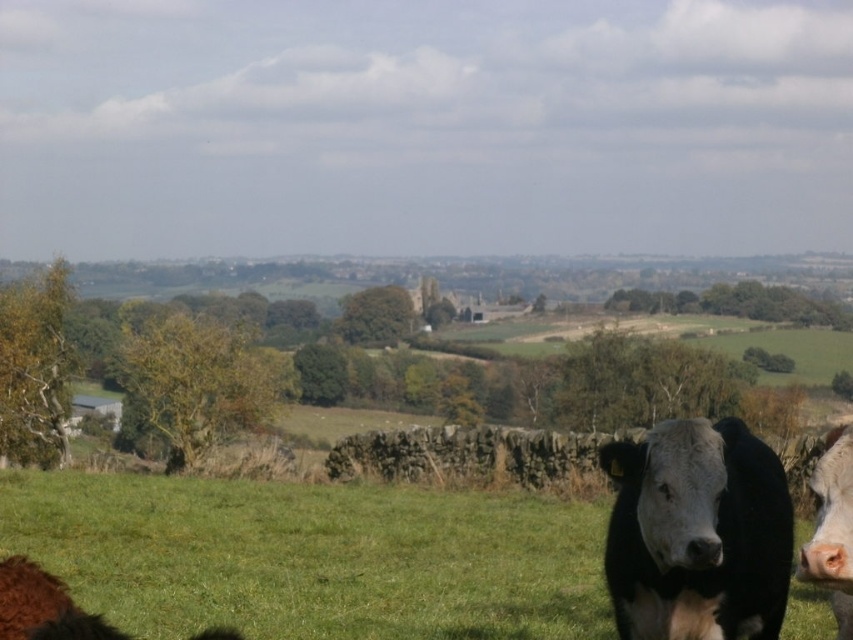
Question: Among these objects, which one is nearest to the camera?

Choices:
 (A) green grassy field at lower center
 (B) black smooth cow at lower right

Answer: (B)

Question: Which point is farther to the camera?

Choices:
 (A) black smooth cow at lower right
 (B) black smooth cow at right

Answer: (B)

Question: Is green grassy field at lower center bigger than black smooth cow at lower right?

Choices:
 (A) no
 (B) yes

Answer: (A)

Question: Which object appears farthest from the camera in this image?

Choices:
 (A) black smooth cow at lower right
 (B) black smooth cow at right
 (C) green grassy field at lower center
 (D) brown fuzzy bull at lower left

Answer: (C)

Question: Does black smooth cow at right appear under brown fuzzy bull at lower left?

Choices:
 (A) no
 (B) yes

Answer: (A)

Question: From the image, what is the correct spatial relationship of green grassy field at lower center in relation to brown fuzzy bull at lower left?

Choices:
 (A) above
 (B) below

Answer: (B)